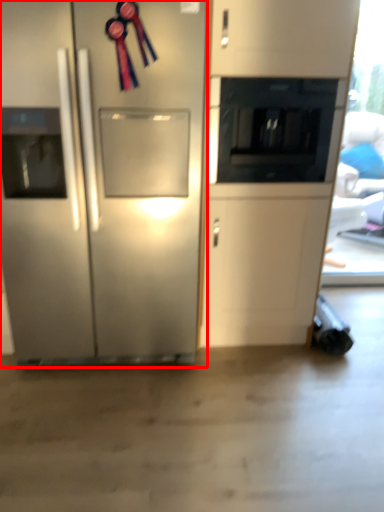
Question: Observing the image, what is the correct spatial positioning of refrigerator (annotated by the red box) in reference to appliance?

Choices:
 (A) right
 (B) left

Answer: (B)